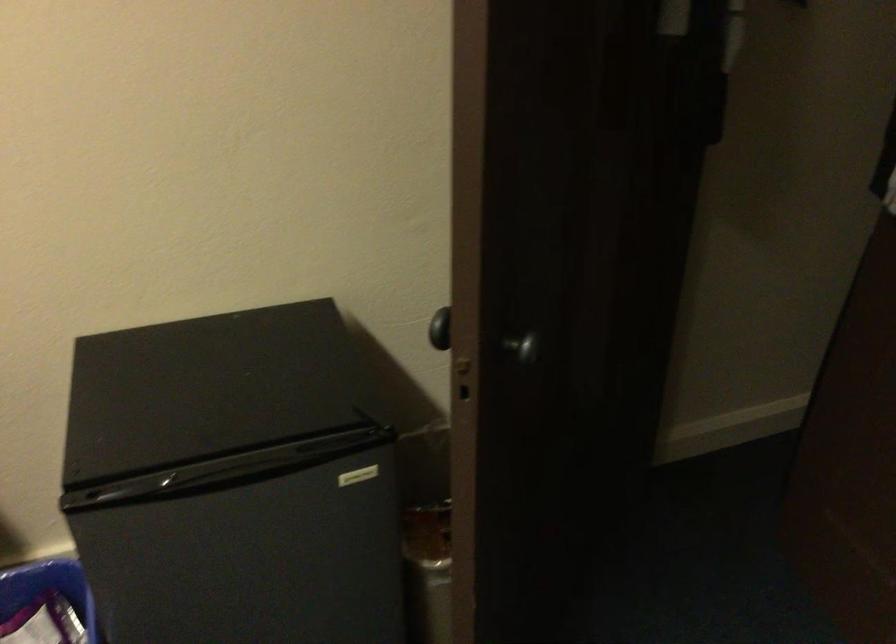
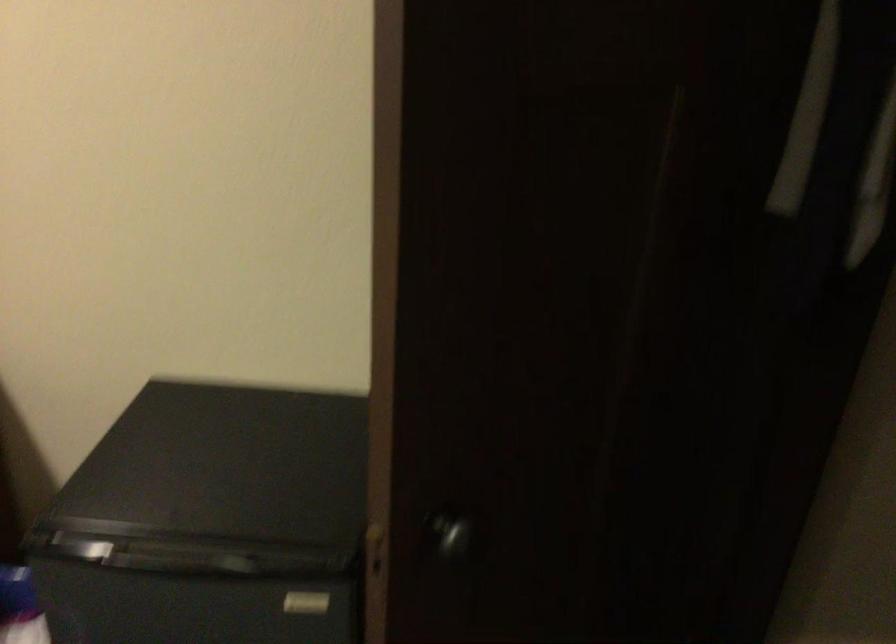
Locate, in the second image, the point that corresponds to (350,478) in the first image.

(306, 603)